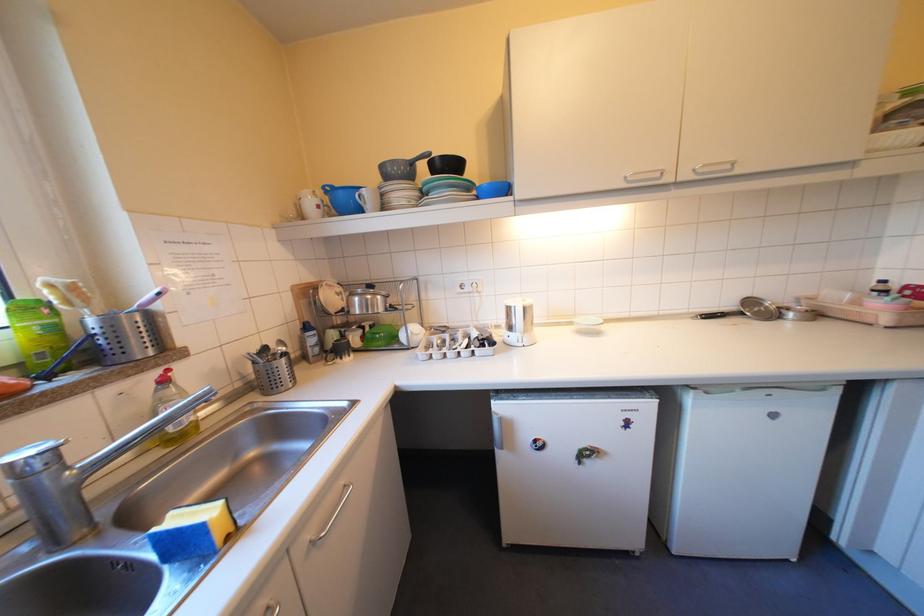
This screenshot has height=616, width=924. I want to click on white electric kettle, so click(x=310, y=205).